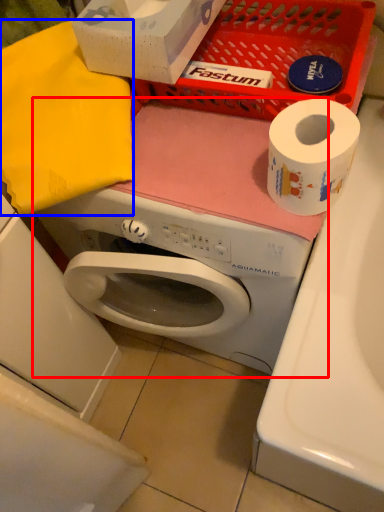
Question: Which point is further to the camera, washing machine (highlighted by a red box) or clothe (highlighted by a blue box)?

Choices:
 (A) washing machine
 (B) clothe

Answer: (B)